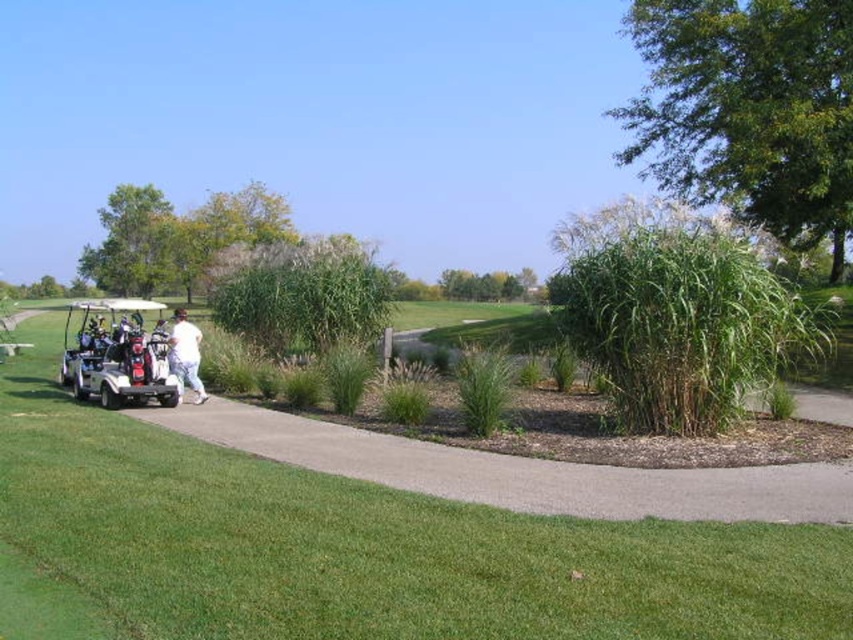
You are standing on the grassy area in front of the white plastic golf cart at left and the white cotton pants at center. Which object is higher in the image?

The white plastic golf cart at left is higher in the image than the white cotton pants at center.